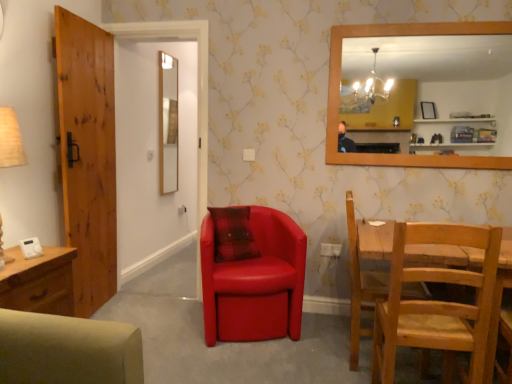
Question: Which direction should I rotate to look at smooth wooden mirror at center, the second mirror from the front?

Choices:
 (A) left
 (B) right

Answer: (A)

Question: Is beige paper table lamp at left to the right of wooden frame mirror at upper right, the 1th mirror from the right, from the viewer's perspective?

Choices:
 (A) no
 (B) yes

Answer: (A)

Question: Considering the relative sizes of beige paper table lamp at left and wooden frame mirror at upper right, the 2th mirror in the back-to-front sequence, in the image provided, is beige paper table lamp at left bigger than wooden frame mirror at upper right, the 2th mirror in the back-to-front sequence,?

Choices:
 (A) yes
 (B) no

Answer: (A)

Question: Does beige paper table lamp at left appear on the left side of wooden frame mirror at upper right, the 1th mirror from the right?

Choices:
 (A) yes
 (B) no

Answer: (A)

Question: Does beige paper table lamp at left turn towards wooden frame mirror at upper right, the 1th mirror from the right?

Choices:
 (A) no
 (B) yes

Answer: (A)

Question: Is beige paper table lamp at left surrounding wooden frame mirror at upper right, the second mirror in the left-to-right sequence?

Choices:
 (A) yes
 (B) no

Answer: (B)

Question: From a real-world perspective, is beige paper table lamp at left positioned over wooden frame mirror at upper right, the 1th mirror from the right, based on gravity?

Choices:
 (A) yes
 (B) no

Answer: (B)

Question: Is matte red leather armchair at center, the 2th chair viewed from the right, thinner than smooth wooden mirror at center, which appears as the first mirror when viewed from the left?

Choices:
 (A) yes
 (B) no

Answer: (B)

Question: From the image's perspective, is matte red leather armchair at center, the 2th chair viewed from the right, on top of smooth wooden mirror at center, the second mirror from the right?

Choices:
 (A) yes
 (B) no

Answer: (B)

Question: From the image's perspective, is matte red leather armchair at center, which is the first chair from left to right, below smooth wooden mirror at center, the second mirror from the front?

Choices:
 (A) no
 (B) yes

Answer: (B)

Question: Are matte red leather armchair at center, which is the first chair from left to right, and smooth wooden mirror at center, the second mirror from the front, located far from each other?

Choices:
 (A) yes
 (B) no

Answer: (A)

Question: Is matte red leather armchair at center, which is the first chair from left to right, to the left of smooth wooden mirror at center, the second mirror from the right, from the viewer's perspective?

Choices:
 (A) yes
 (B) no

Answer: (B)

Question: Is matte red leather armchair at center, the 2th chair viewed from the right, positioned behind smooth wooden mirror at center, the second mirror from the right?

Choices:
 (A) no
 (B) yes

Answer: (A)

Question: Can you confirm if wooden door at left is shorter than light brown wooden chair at lower right, arranged as the 2th chair when viewed from the left?

Choices:
 (A) yes
 (B) no

Answer: (B)